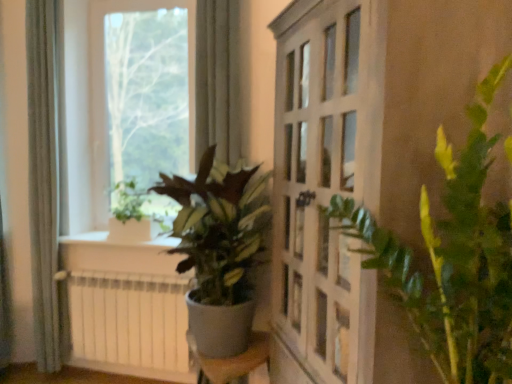
Question: From a real-world perspective, is green matte plant at center, the second houseplant in the back-to-front sequence, positioned over gray fabric curtain at left based on gravity?

Choices:
 (A) yes
 (B) no

Answer: (B)

Question: Is green matte plant at center, the second houseplant positioned from the front, next to gray fabric curtain at left?

Choices:
 (A) yes
 (B) no

Answer: (B)

Question: Is green matte plant at center, the second houseplant in the back-to-front sequence, positioned far away from gray fabric curtain at left?

Choices:
 (A) no
 (B) yes

Answer: (B)

Question: Is green matte plant at center, the second houseplant in the back-to-front sequence, thinner than gray fabric curtain at left?

Choices:
 (A) no
 (B) yes

Answer: (A)

Question: Is green matte plant at center, the second houseplant positioned from the front, surrounding gray fabric curtain at left?

Choices:
 (A) yes
 (B) no

Answer: (B)

Question: Is green matte plant at center, the second houseplant positioned from the front, to the left or to the right of transparent glass window at upper left in the image?

Choices:
 (A) right
 (B) left

Answer: (A)

Question: Is green matte plant at center, the second houseplant in the back-to-front sequence, taller or shorter than transparent glass window at upper left?

Choices:
 (A) short
 (B) tall

Answer: (A)

Question: Is green matte plant at center, the second houseplant in the back-to-front sequence, spatially inside transparent glass window at upper left, or outside of it?

Choices:
 (A) outside
 (B) inside

Answer: (A)

Question: Considering their positions, is green matte plant at center, the second houseplant positioned from the front, located in front of or behind transparent glass window at upper left?

Choices:
 (A) front
 (B) behind

Answer: (A)

Question: Considering the positions of green leafy plant at right, which is the first houseplant from front to back, and green matte plant at upper left, which is the third houseplant in front-to-back order, in the image, is green leafy plant at right, which is the first houseplant from front to back, wider or thinner than green matte plant at upper left, which is the third houseplant in front-to-back order,?

Choices:
 (A) wide
 (B) thin

Answer: (A)

Question: Is green leafy plant at right, the 3th houseplant when ordered from back to front, taller or shorter than green matte plant at upper left, placed as the first houseplant when sorted from back to front?

Choices:
 (A) tall
 (B) short

Answer: (A)

Question: Would you say green leafy plant at right, the 3th houseplant when ordered from back to front, is inside or outside green matte plant at upper left, which is the third houseplant in front-to-back order?

Choices:
 (A) outside
 (B) inside

Answer: (A)

Question: From a real-world perspective, relative to green matte plant at upper left, which is the third houseplant in front-to-back order, is green leafy plant at right, which is the first houseplant from front to back, vertically above or below?

Choices:
 (A) below
 (B) above

Answer: (B)

Question: Is transparent glass window at upper left in front of or behind white matte radiator at lower left in the image?

Choices:
 (A) front
 (B) behind

Answer: (B)

Question: From their relative heights in the image, would you say transparent glass window at upper left is taller or shorter than white matte radiator at lower left?

Choices:
 (A) short
 (B) tall

Answer: (B)